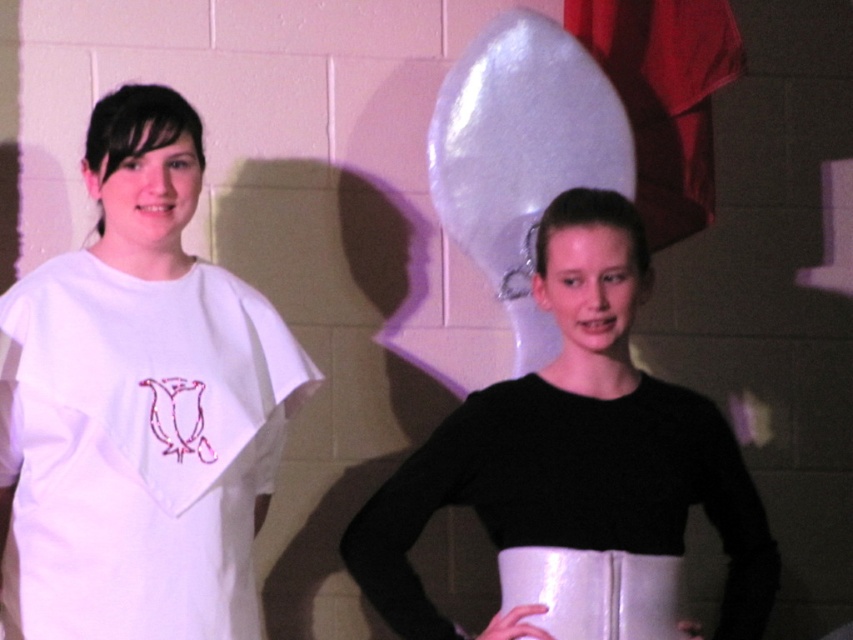
Who is positioned more to the left, white matte t-shirt at left or black matte sweater at center?

Positioned to the left is white matte t-shirt at left.

Is white matte t-shirt at left shorter than black matte sweater at center?

Incorrect, white matte t-shirt at left's height does not fall short of black matte sweater at center's.

Which is behind, point (167, 195) or point (495, 502)?

Point (167, 195)

The width and height of the screenshot is (853, 640). I want to click on white matte t-shirt at left, so click(x=141, y=404).

Between point (132, 352) and point (641, 573), which one is positioned behind?

The point (132, 352) is behind.

Does white matte t-shirt at left come in front of white glossy apron at lower center?

No, white matte t-shirt at left is behind white glossy apron at lower center.

Between point (103, 499) and point (547, 596), which one is positioned behind?

Positioned behind is point (103, 499).

I want to click on white matte t-shirt at left, so click(x=141, y=404).

Is black matte sweater at center positioned at the back of white glossy apron at lower center?

Yes.

Which of these two, black matte sweater at center or white glossy apron at lower center, stands shorter?

white glossy apron at lower center is shorter.

At what (x,y) coordinates should I click in order to perform the action: click on black matte sweater at center. Please return your answer as a coordinate pair (x, y). This screenshot has height=640, width=853. Looking at the image, I should click on (575, 444).

Identify the location of black matte sweater at center. This screenshot has width=853, height=640. (575, 444).